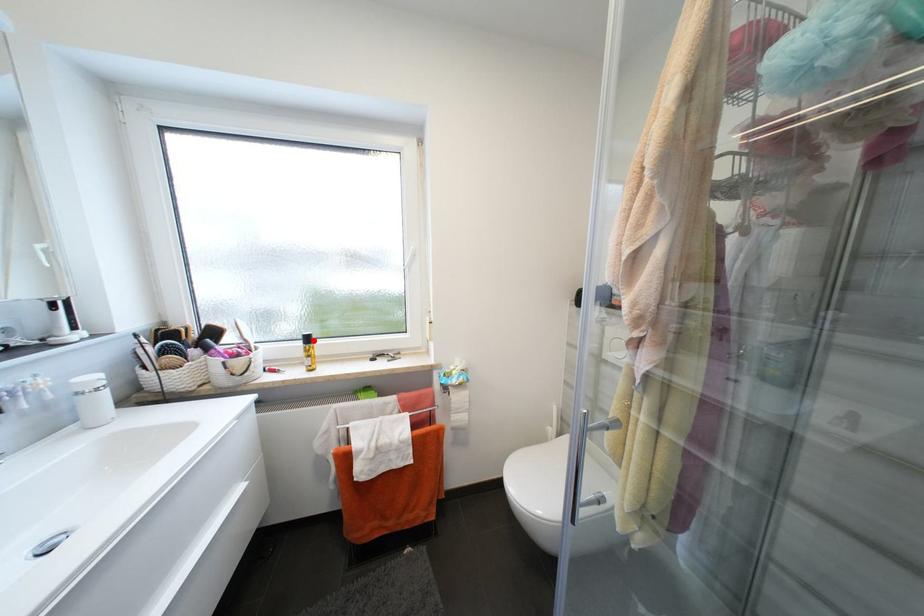
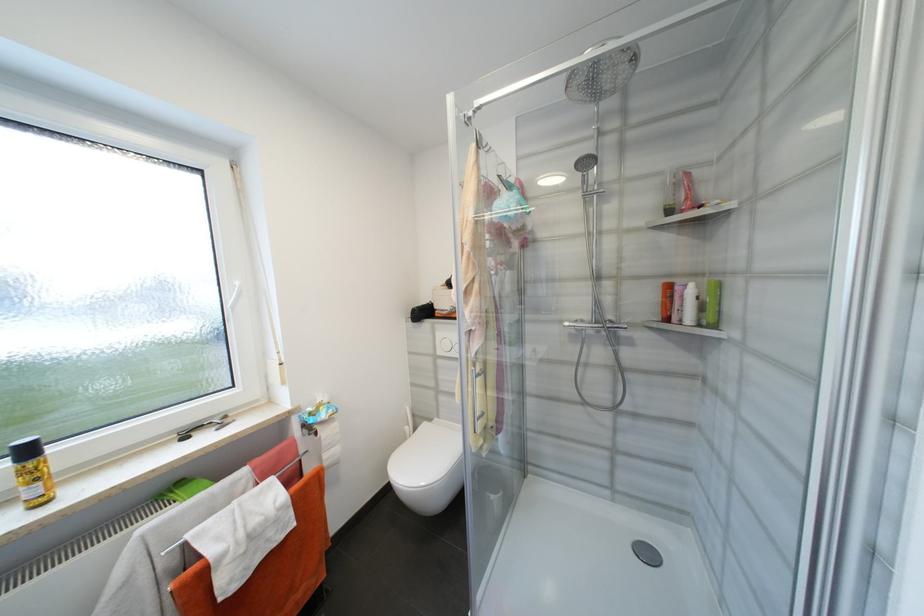
The point at the highlighted location is marked in the first image. Where is the corresponding point in the second image?

(33, 453)